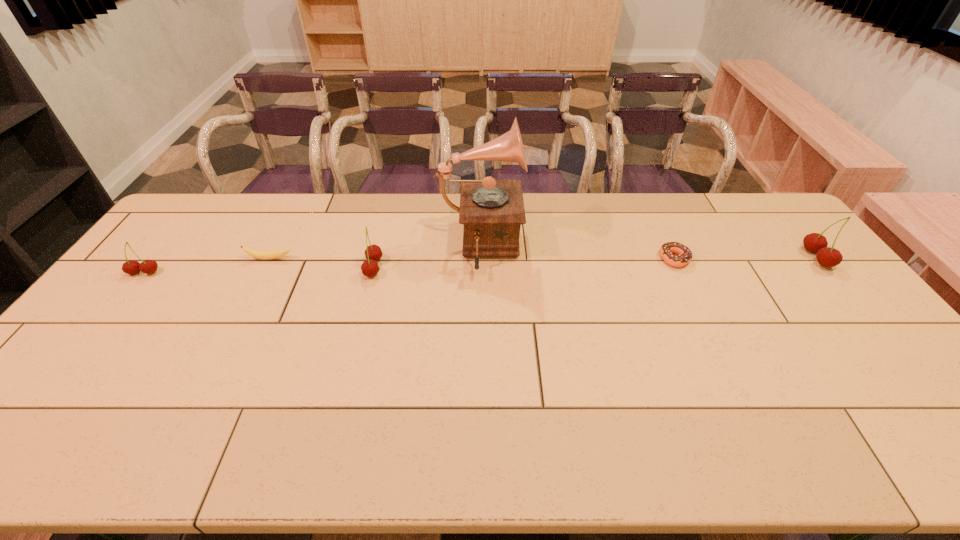
At what (x,y) coordinates should I click in order to perform the action: click on the shortest cherry. Please return your answer as a coordinate pair (x, y). Looking at the image, I should click on (131, 267).

Identify the location of the leftmost object. This screenshot has height=540, width=960. (131, 267).

Image resolution: width=960 pixels, height=540 pixels. I want to click on the second cherry from right to left, so pos(373,253).

Find the location of `the third object from left to right`. the third object from left to right is located at coordinates (373, 253).

Locate an element on the screen. The image size is (960, 540). the rightmost cherry is located at coordinates (828, 257).

You are a GUI agent. You are given a task and a screenshot of the screen. Output one action in this format:
    pyautogui.click(x=<x>, y=<y>)
    Task: Click on the banana
    The width and height of the screenshot is (960, 540).
    Given the screenshot: What is the action you would take?
    pyautogui.click(x=264, y=255)

This screenshot has width=960, height=540. Find the location of `the second shortest object`. the second shortest object is located at coordinates click(264, 255).

What are the coordinates of `the fourth object from left to right` in the screenshot? It's located at (492, 211).

The width and height of the screenshot is (960, 540). I want to click on record player, so click(x=492, y=211).

Locate an element on the screen. The image size is (960, 540). doughnut is located at coordinates [684, 256].